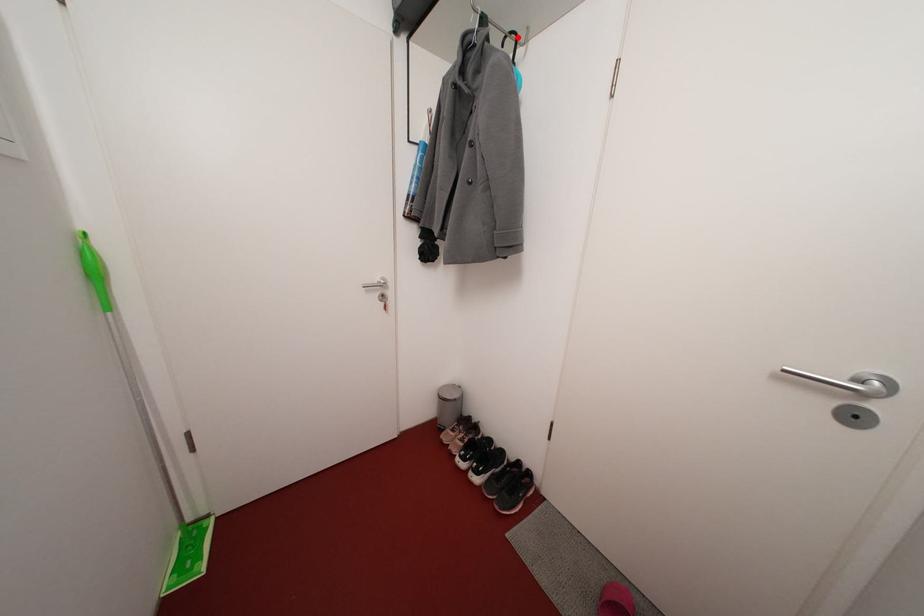
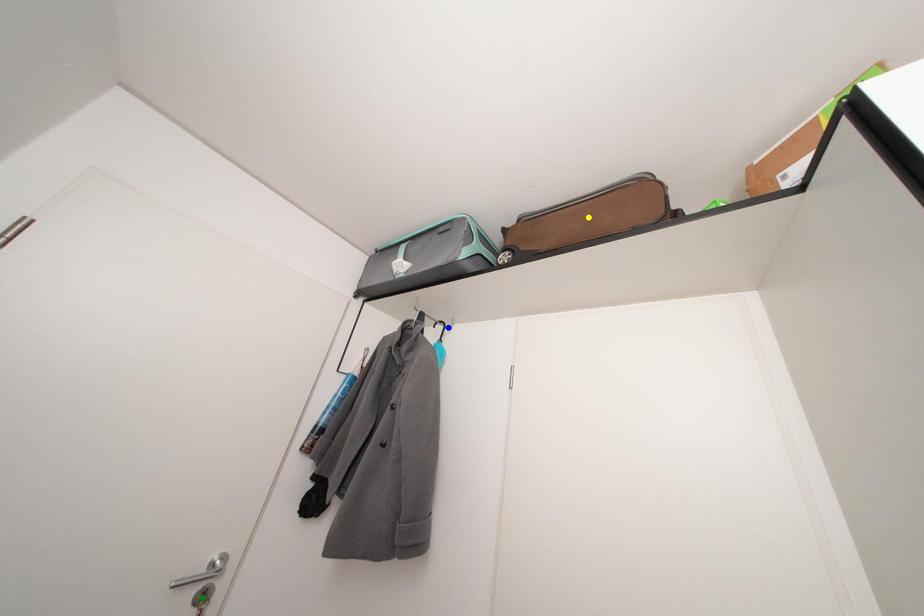
Question: I am providing you with two images of the same scene from different viewpoints. A red point is marked on the first image. You are given multiple points on the second image. Can you choose the point in image 2 that corresponds to the point in image 1?

Choices:
 (A) yellow point
 (B) green point
 (C) blue point

Answer: (C)